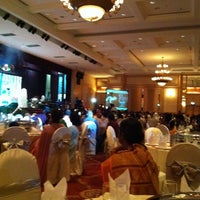
Find the location of a particular element. The height and width of the screenshot is (200, 200). clear glass is located at coordinates (170, 192).